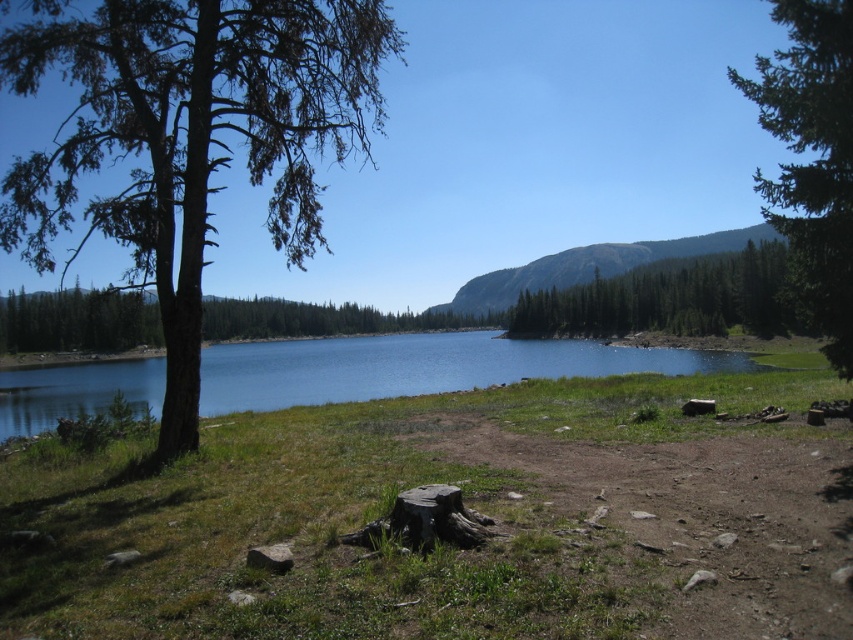
Question: Considering the real-world distances, which object is farthest from the green textured tree at left?

Choices:
 (A) green textured tree at upper center
 (B) green textured tree at upper right
 (C) blue water at center

Answer: (B)

Question: Which of the following is the farthest from the observer?

Choices:
 (A) green textured tree at upper center
 (B) green textured tree at left
 (C) blue water at center
 (D) green textured tree at upper right

Answer: (C)

Question: Is green textured tree at left further to the viewer compared to green textured tree at upper center?

Choices:
 (A) yes
 (B) no

Answer: (B)

Question: Based on their relative distances, which object is farther from the blue water at center?

Choices:
 (A) green textured tree at upper right
 (B) green textured tree at left
 (C) green textured tree at upper center

Answer: (A)

Question: Is green textured tree at left above blue water at center?

Choices:
 (A) yes
 (B) no

Answer: (A)

Question: Observing the image, what is the correct spatial positioning of green textured tree at left in reference to green textured tree at upper center?

Choices:
 (A) below
 (B) above

Answer: (B)